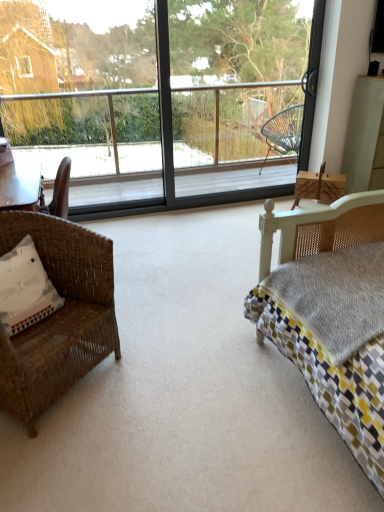
This screenshot has width=384, height=512. In order to click on woven brown chair at left in this screenshot , I will do `click(58, 315)`.

Where is `transparent glass window at center`? This screenshot has height=512, width=384. transparent glass window at center is located at coordinates (165, 102).

This screenshot has width=384, height=512. Identify the location of woven brown chair at left. (58, 315).

Is woven brown chair at left to the left of transparent glass screen door at center from the viewer's perspective?

Yes.

From the image's perspective, which one is positioned higher, woven brown chair at left or transparent glass screen door at center?

transparent glass screen door at center, from the image's perspective.

Are woven brown chair at left and transparent glass screen door at center far apart?

Yes.

Considering the points (85, 326) and (205, 111), which point is in front, point (85, 326) or point (205, 111)?

The point (85, 326) is in front.

Considering the relative sizes of transparent glass screen door at center and white fabric pillow at left in the image provided, is transparent glass screen door at center smaller than white fabric pillow at left?

Actually, transparent glass screen door at center might be larger than white fabric pillow at left.

Is transparent glass screen door at center in front of or behind white fabric pillow at left in the image?

Visually, transparent glass screen door at center is located behind white fabric pillow at left.

Does transparent glass screen door at center have a greater width compared to white fabric pillow at left?

Incorrect, the width of transparent glass screen door at center does not surpass that of white fabric pillow at left.

Find the location of a particular element. The image size is (384, 512). pillow located below the transparent glass screen door at center (from the image's perspective) is located at coordinates pos(25,289).

From the image's perspective, is white fabric pillow at left above woven brown chair at left?

Yes.

Is white fabric pillow at left at the right side of woven brown chair at left?

Incorrect, white fabric pillow at left is not on the right side of woven brown chair at left.

Is white fabric pillow at left oriented towards woven brown chair at left?

Yes, white fabric pillow at left is turned towards woven brown chair at left.

Does transparent glass window at center have a lesser height compared to white fabric pillow at left?

No.

From the image's perspective, which object appears higher, transparent glass window at center or white fabric pillow at left?

transparent glass window at center is shown above in the image.

Looking at this image, which is more to the right, transparent glass window at center or woven brown chair at left?

→ transparent glass window at center.

Is point (160, 118) behind point (1, 229)?

Yes, it is behind point (1, 229).

Is transparent glass window at center positioned before woven brown chair at left?

No, transparent glass window at center is behind woven brown chair at left.

Is transparent glass screen door at center positioned with its back to woven brown chair at left?

No.

Is point (272, 71) in front of point (14, 415)?

No, it is not.

From a real-world perspective, which is physically above, transparent glass screen door at center or woven brown chair at left?

From a 3D spatial view, transparent glass screen door at center is above.

Is transparent glass screen door at center thinner than woven brown chair at left?

Yes, transparent glass screen door at center is thinner than woven brown chair at left.

Does woven brown chair at left lie behind white fabric pillow at left?

No, woven brown chair at left is in front of white fabric pillow at left.

Is woven brown chair at left bigger than white fabric pillow at left?

Correct, woven brown chair at left is larger in size than white fabric pillow at left.

From the picture: Which is nearer, [21,232] or [26,328]?

Point [26,328]

Where is `screen door above the woven brown chair at left (from the image's perspective)`? Image resolution: width=384 pixels, height=512 pixels. screen door above the woven brown chair at left (from the image's perspective) is located at coordinates (237, 87).

You are a GUI agent. You are given a task and a screenshot of the screen. Output one action in this format:
    pyautogui.click(x=<x>, y=<y>)
    Task: Click on the pillow that appears below the transparent glass screen door at center (from the image's perspective)
    
    Given the screenshot: What is the action you would take?
    pyautogui.click(x=25, y=289)

Looking at the image, which one is located closer to white fabric pillow at left, transparent glass window at center or transparent glass screen door at center?

transparent glass window at center lies closer to white fabric pillow at left than the other object.

Based on their spatial positions, is woven brown chair at left or transparent glass screen door at center closer to transparent glass window at center?

transparent glass screen door at center is closer to transparent glass window at center.

Considering their positions, is white fabric pillow at left positioned further to woven brown chair at left than transparent glass window at center?

The object further to woven brown chair at left is transparent glass window at center.

Looking at the image, which one is located closer to white fabric pillow at left, transparent glass screen door at center or transparent glass window at center?

Based on the image, transparent glass window at center appears to be nearer to white fabric pillow at left.

Considering their positions, is woven brown chair at left positioned closer to transparent glass window at center than white fabric pillow at left?

The object closer to transparent glass window at center is woven brown chair at left.

Looking at the image, which one is located closer to transparent glass screen door at center, woven brown chair at left or transparent glass window at center?

transparent glass window at center.

Which object lies nearer to the anchor point transparent glass window at center, transparent glass screen door at center or woven brown chair at left?

The object closer to transparent glass window at center is transparent glass screen door at center.

Looking at the image, which one is located further to transparent glass screen door at center, transparent glass window at center or white fabric pillow at left?

white fabric pillow at left is further to transparent glass screen door at center.

The height and width of the screenshot is (512, 384). I want to click on pillow between woven brown chair at left and transparent glass screen door at center in the front-back direction, so click(x=25, y=289).

Image resolution: width=384 pixels, height=512 pixels. I want to click on window between transparent glass screen door at center and white fabric pillow at left in the up-down direction, so click(x=165, y=102).

The height and width of the screenshot is (512, 384). What are the coordinates of `pillow between transparent glass window at center and woven brown chair at left vertically` in the screenshot? It's located at (25, 289).

In order to click on window between woven brown chair at left and transparent glass screen door at center along the z-axis in this screenshot , I will do `click(165, 102)`.